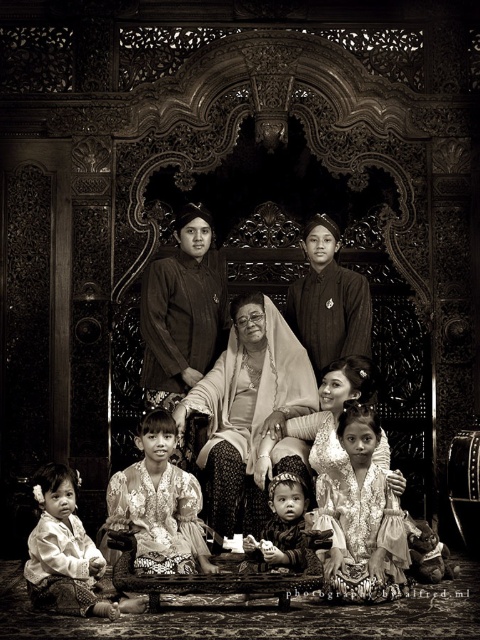
Looking at the black and white photo of the family group, which object is covering the other one? The matte white shawl at center or the silky white dress at center?

The matte white shawl at center is positioned over the silky white dress at center.

You are standing at the entrance of the room and see the matte white shawl at center and the silky white dress at center. Which object is closer to you?

The matte white shawl at center and the silky white dress at center are both at the center, so they are equally distant from you.

You are a photographer who wants to ensure that the matte white shawl at center and the silk fabric children at center are both visible in the final photo. Given their sizes, which object should you focus on to ensure both are captured clearly?

Answer: The matte white shawl at center is smaller than the silk fabric children at center. To ensure both are visible, focus on the silk fabric children at center since it is larger and will remain in focus while the smaller shawl can be framed around it.